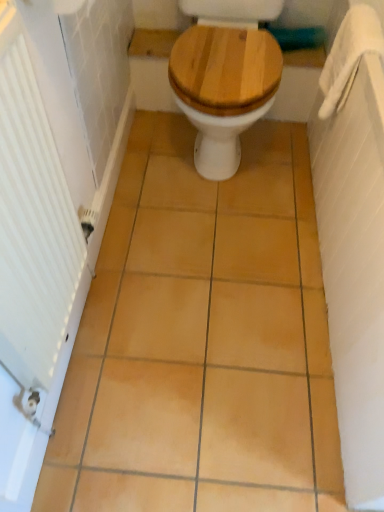
Question: Is white fabric towel bar at upper right wider or thinner than matte yellow tile at center?

Choices:
 (A) wide
 (B) thin

Answer: (B)

Question: Considering their positions, is white fabric towel bar at upper right located in front of or behind matte yellow tile at center?

Choices:
 (A) front
 (B) behind

Answer: (B)

Question: Considering the real-world distances, which object is farthest from the matte yellow tile at center?

Choices:
 (A) wooden at center
 (B) white textured towel at right
 (C) white textured radiator at left
 (D) white fabric towel bar at upper right

Answer: (D)

Question: Which is farther from the wooden at center?

Choices:
 (A) white textured towel at right
 (B) white textured radiator at left
 (C) matte yellow tile at center
 (D) white fabric towel bar at upper right

Answer: (B)